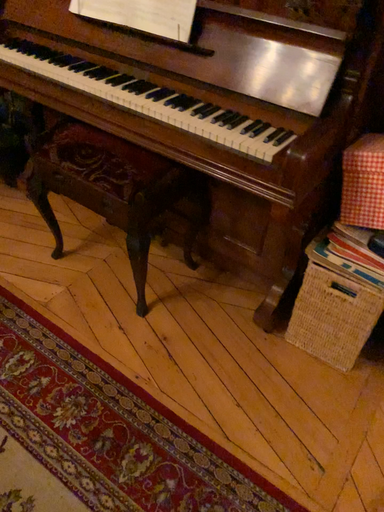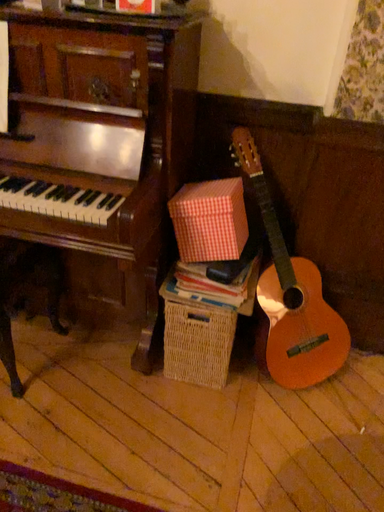
Question: How did the camera likely rotate when shooting the video?

Choices:
 (A) rotated upward
 (B) rotated downward

Answer: (A)